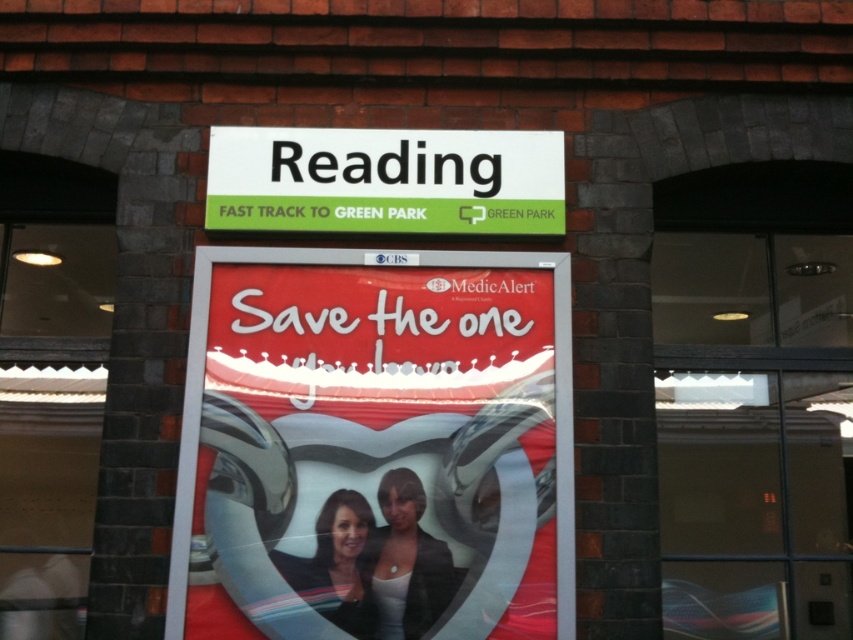
Can you confirm if transparent glass door at center is wider than smooth black hair at center?

Correct, the width of transparent glass door at center exceeds that of smooth black hair at center.

Is transparent glass door at center closer to the viewer compared to smooth black hair at center?

No.

Is point (728, 336) positioned in front of point (341, 588)?

No, (728, 336) is further to viewer.

Locate an element on the screen. transparent glass door at center is located at coordinates (753, 401).

Does matte plastic poster at center appear under smooth black hair at center?

No.

Can you confirm if matte plastic poster at center is taller than smooth black hair at center?

Correct, matte plastic poster at center is much taller as smooth black hair at center.

Is point (387, 529) positioned behind point (351, 531)?

Yes.

Locate an element on the screen. This screenshot has height=640, width=853. matte plastic poster at center is located at coordinates (375, 445).

Does transparent glass door at center appear on the right side of white plastic sign at upper center?

Yes, transparent glass door at center is to the right of white plastic sign at upper center.

Looking at this image, is transparent glass door at center shorter than white plastic sign at upper center?

No, transparent glass door at center is not shorter than white plastic sign at upper center.

Is point (752, 433) positioned behind point (231, 168)?

Yes, it is.

Image resolution: width=853 pixels, height=640 pixels. In order to click on transparent glass door at center in this screenshot , I will do `click(753, 401)`.